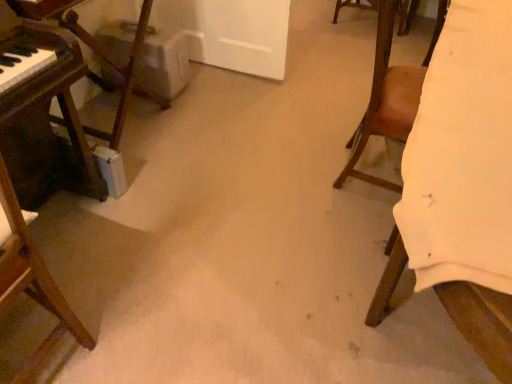
Question: Is brown leather chair at right, the 1th chair from the right, thinner than white fabric at right, the 2th furniture from the left?

Choices:
 (A) no
 (B) yes

Answer: (B)

Question: From the image's perspective, would you say brown leather chair at right, which is the second chair in left-to-right order, is shown under white fabric at right, the first furniture viewed from the right?

Choices:
 (A) yes
 (B) no

Answer: (B)

Question: Considering the relative sizes of brown leather chair at right, the 1th chair from the right, and white fabric at right, the first furniture viewed from the right, in the image provided, is brown leather chair at right, the 1th chair from the right, smaller than white fabric at right, the first furniture viewed from the right,?

Choices:
 (A) no
 (B) yes

Answer: (B)

Question: Is brown leather chair at right, which is the second chair in left-to-right order, facing away from white fabric at right, the first furniture viewed from the right?

Choices:
 (A) no
 (B) yes

Answer: (B)

Question: From a real-world perspective, is brown leather chair at right, the 1th chair from the right, on white fabric at right, the 2th furniture from the left?

Choices:
 (A) yes
 (B) no

Answer: (A)

Question: Considering the relative positions of brown leather chair at right, which is the second chair in left-to-right order, and white fabric at right, the first furniture viewed from the right, in the image provided, is brown leather chair at right, which is the second chair in left-to-right order, to the right of white fabric at right, the first furniture viewed from the right, from the viewer's perspective?

Choices:
 (A) yes
 (B) no

Answer: (B)

Question: Considering the relative sizes of white fabric at right, the 2th furniture from the left, and brown wooden chair at left, which is the 1th chair in left-to-right order, in the image provided, is white fabric at right, the 2th furniture from the left, shorter than brown wooden chair at left, which is the 1th chair in left-to-right order,?

Choices:
 (A) yes
 (B) no

Answer: (A)

Question: From a real-world perspective, is white fabric at right, the first furniture viewed from the right, under brown wooden chair at left, which is the 1th chair in left-to-right order?

Choices:
 (A) yes
 (B) no

Answer: (A)

Question: From the image's perspective, is white fabric at right, the 2th furniture from the left, above brown wooden chair at left, the 2th chair from the right?

Choices:
 (A) no
 (B) yes

Answer: (B)

Question: Can we say white fabric at right, the first furniture viewed from the right, lies outside brown wooden chair at left, the 2th chair from the right?

Choices:
 (A) no
 (B) yes

Answer: (B)

Question: Considering the relative sizes of white fabric at right, the first furniture viewed from the right, and brown wooden chair at left, which is the 1th chair in left-to-right order, in the image provided, is white fabric at right, the first furniture viewed from the right, bigger than brown wooden chair at left, which is the 1th chair in left-to-right order,?

Choices:
 (A) no
 (B) yes

Answer: (B)

Question: Are white fabric at right, the 2th furniture from the left, and brown wooden chair at left, the 2th chair from the right, making contact?

Choices:
 (A) yes
 (B) no

Answer: (B)

Question: Considering the relative sizes of wooden piano at left, acting as the 2th furniture starting from the right, and white fabric at right, the 2th furniture from the left, in the image provided, is wooden piano at left, acting as the 2th furniture starting from the right, thinner than white fabric at right, the 2th furniture from the left,?

Choices:
 (A) yes
 (B) no

Answer: (A)